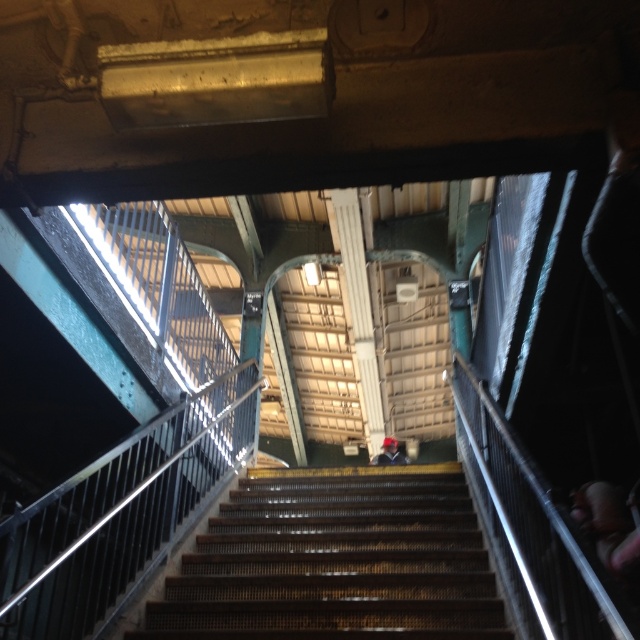
Is metallic brown stairs at center wider than dark blue fabric jacket at center?

Indeed, metallic brown stairs at center has a greater width compared to dark blue fabric jacket at center.

Between metallic brown stairs at center and dark blue fabric jacket at center, which one has less height?

metallic brown stairs at center is shorter.

I want to click on metallic brown stairs at center, so click(336, 561).